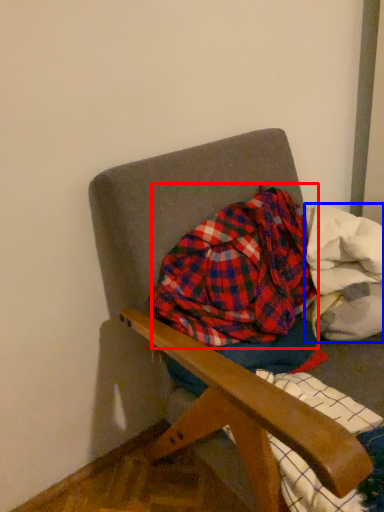
Question: Among these objects, which one is farthest to the camera, flannel (highlighted by a red box) or material (highlighted by a blue box)?

Choices:
 (A) flannel
 (B) material

Answer: (B)